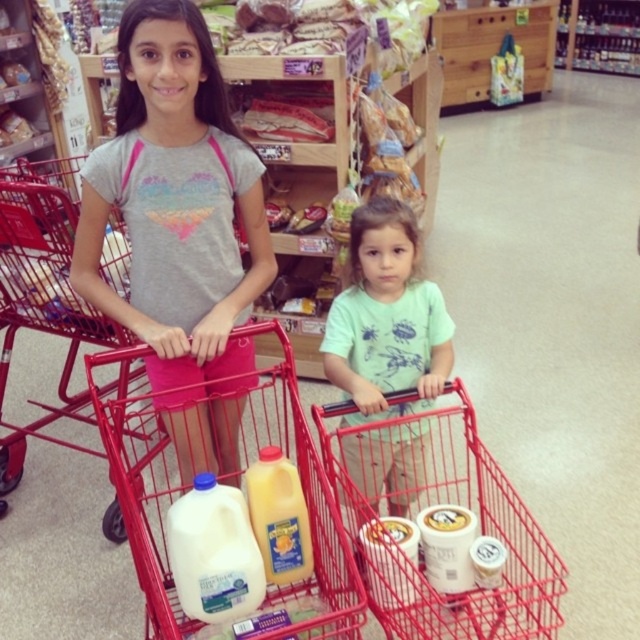
You are a grocery store employee who needs to rearrange the items in the shopping cart. The manager requires that the white matte yogurt at lower center must be placed to the right of the yellow matte plastic bottle at center. Is the current arrangement already meeting this requirement?

The yellow matte plastic bottle at center is positioned on the left side of white matte yogurt at lower center, so the current arrangement already meets the manager requirement.